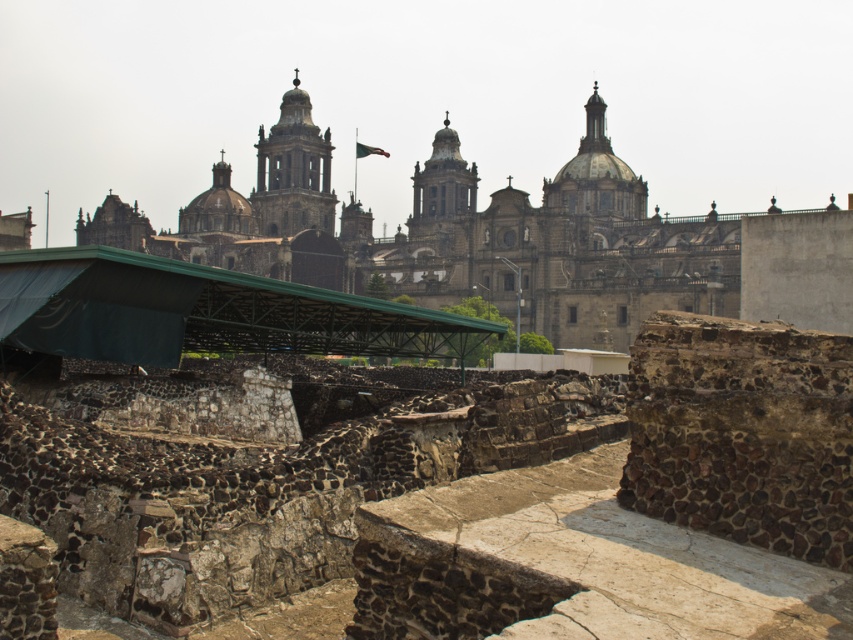
You are an archaeologist examining the historical site. You notice the brown stone ruins at center and the smooth stone tower at center. Which structure is taller?

The brown stone ruins at center is taller than the smooth stone tower at center.

You are standing at point [508,240] in the image. What is the object located at that point?

The object located at point [508,240] is brown stone ruins at center.

You are an archaeologist planning to excavate the area between the brown stone ruins at center and the smooth stone tower at center. Which structure should you prioritize if you want to work on the wider one first?

The brown stone ruins at center might be wider than the smooth stone tower at center, so you should prioritize excavating the brown stone ruins at center first.